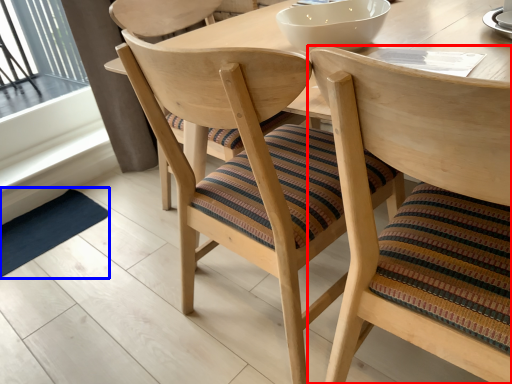
Question: Which object is further to the camera taking this photo, chair (highlighted by a red box) or mat (highlighted by a blue box)?

Choices:
 (A) chair
 (B) mat

Answer: (B)